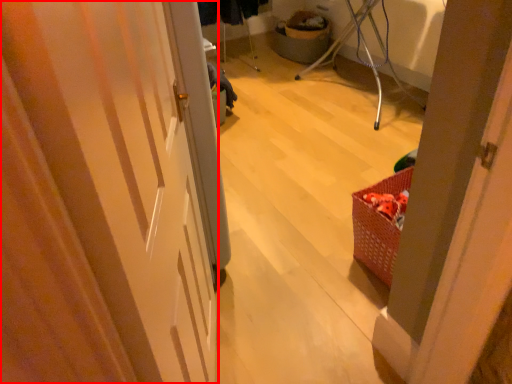
Question: Where is door (annotated by the red box) located in relation to basket in the image?

Choices:
 (A) left
 (B) right

Answer: (A)